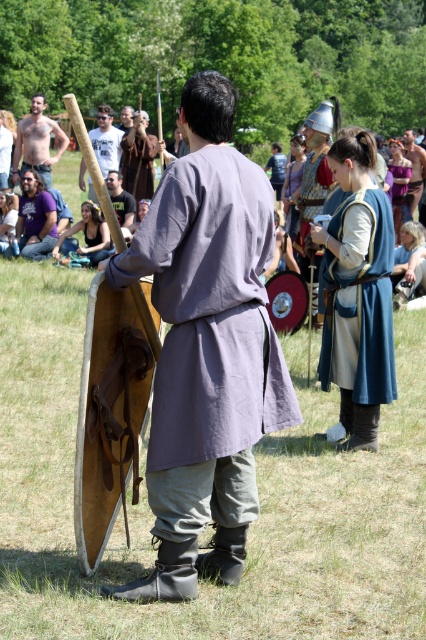
Question: Which point is closer to the camera?

Choices:
 (A) (111, 188)
 (B) (342, 282)
 (C) (147, 115)

Answer: (B)

Question: Is blue velvet tunic at center positioned at the back of shiny silver sword at upper left?

Choices:
 (A) no
 (B) yes

Answer: (A)

Question: Among these points, which one is nearest to the camera?

Choices:
 (A) (46, 156)
 (B) (388, 253)

Answer: (B)

Question: Which point is closer to the camera?

Choices:
 (A) matte gray tunic at center
 (B) brown leather tunic at center

Answer: (A)

Question: Does blue denim shirt at center lie in front of matte brown shield at center?

Choices:
 (A) yes
 (B) no

Answer: (B)

Question: Can you confirm if purple cotton shirt at center is positioned to the right of blue denim shirt at center?

Choices:
 (A) yes
 (B) no

Answer: (B)